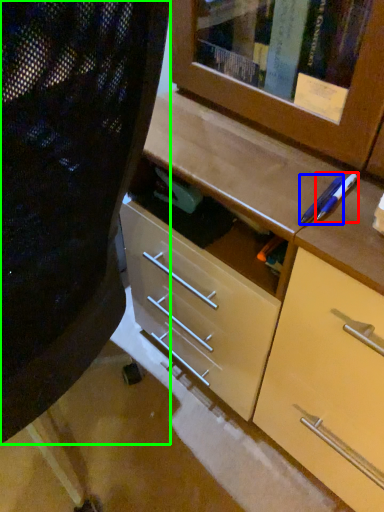
Question: Which object is positioned farthest from pencil (highlighted by a red box)? Select from pencil (highlighted by a blue box) and folding chair (highlighted by a green box).

Choices:
 (A) pencil
 (B) folding chair

Answer: (B)